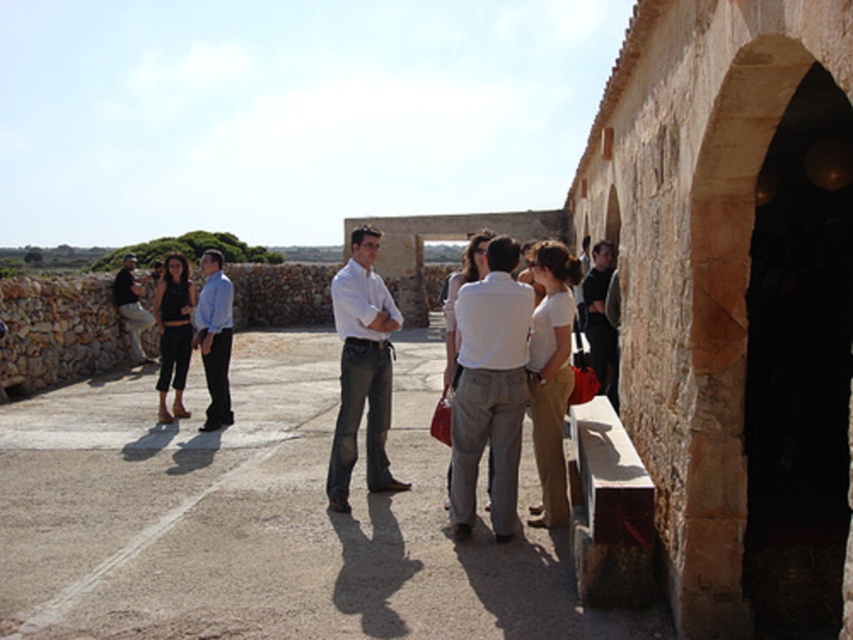
Question: Which point is closer to the camera?

Choices:
 (A) matte blue shirt at center
 (B) matte white shirt at center
 (C) matte black shirt at left

Answer: (B)

Question: Is stone archway at right smaller than matte blue shirt at center?

Choices:
 (A) yes
 (B) no

Answer: (B)

Question: Considering the relative positions of stone archway at right and matte white shirt at center in the image provided, where is stone archway at right located with respect to matte white shirt at center?

Choices:
 (A) left
 (B) right

Answer: (B)

Question: Which of the following is the farthest from the observer?

Choices:
 (A) (798, 275)
 (B) (129, 333)
 (C) (503, 442)

Answer: (B)

Question: Is matte white shirt at center below matte blue shirt at center?

Choices:
 (A) yes
 (B) no

Answer: (A)

Question: Which of the following is the farthest from the observer?

Choices:
 (A) white cotton shirt at center
 (B) matte blue shirt at center

Answer: (B)